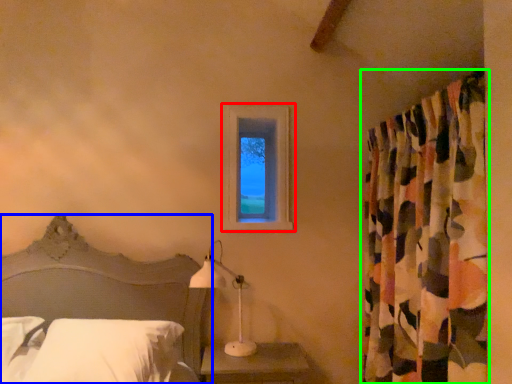
Question: Which object is positioned closest to window (highlighted by a red box)? Select from bed (highlighted by a blue box) and curtain (highlighted by a green box).

Choices:
 (A) bed
 (B) curtain

Answer: (A)